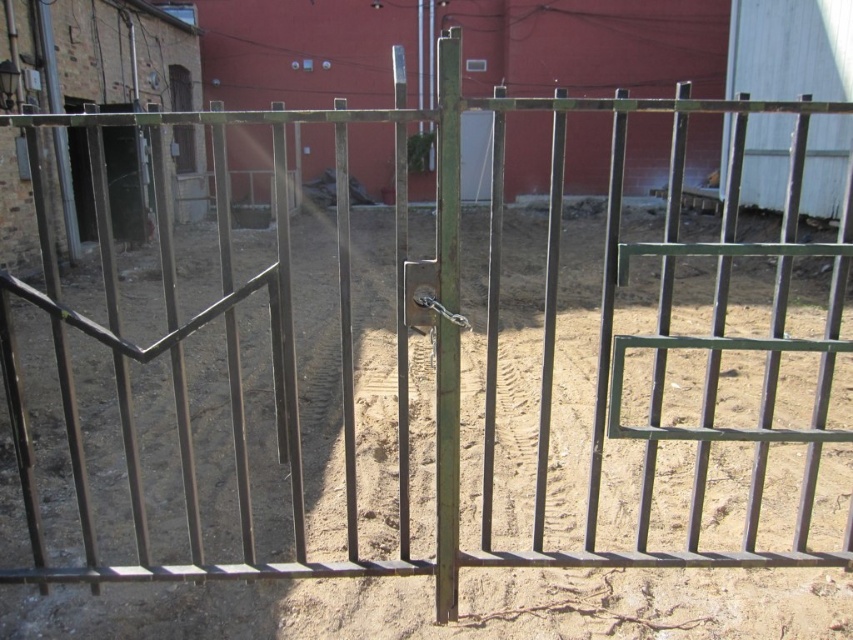
Does metallic silver door at center have a lesser width compared to wooden door at upper left?

Incorrect, metallic silver door at center's width is not less than wooden door at upper left's.

Is metallic silver door at center above wooden door at upper left?

Yes.

Describe the element at coordinates (474, 154) in the screenshot. The image size is (853, 640). I see `metallic silver door at center` at that location.

Where is `metallic silver door at center`? The height and width of the screenshot is (640, 853). metallic silver door at center is located at coordinates (474, 154).

Can you confirm if metallic silver door at center is taller than metallic gate at left?

Incorrect, metallic silver door at center's height is not larger of metallic gate at left's.

Is point (469, 141) closer to camera compared to point (74, 131)?

No, (469, 141) is further to viewer.

Is point (473, 147) more distant than point (85, 216)?

That is True.

The width and height of the screenshot is (853, 640). Identify the location of metallic silver door at center. (474, 154).

What do you see at coordinates (80, 182) in the screenshot? I see `metallic gate at left` at bounding box center [80, 182].

This screenshot has width=853, height=640. In order to click on metallic gate at left in this screenshot , I will do `click(80, 182)`.

Is point (80, 131) positioned after point (183, 72)?

No.

At what (x,y) coordinates should I click in order to perform the action: click on metallic gate at left. Please return your answer as a coordinate pair (x, y). The width and height of the screenshot is (853, 640). Looking at the image, I should click on (80, 182).